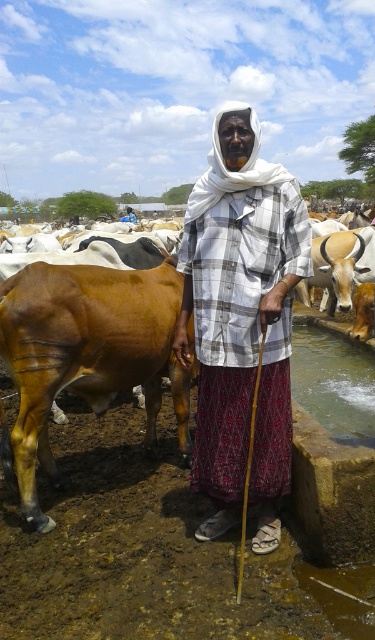
Question: Can you confirm if white checkered shirt at center is smaller than brown glossy bull at left?

Choices:
 (A) yes
 (B) no

Answer: (A)

Question: Which point is farther from the camera taking this photo?

Choices:
 (A) (268, 198)
 (B) (114, 285)

Answer: (B)

Question: Which point is farther to the camera?

Choices:
 (A) (265, 522)
 (B) (169, 365)

Answer: (B)

Question: Where is white checkered shirt at center located in relation to brown glossy bull at left in the image?

Choices:
 (A) right
 (B) left

Answer: (A)

Question: Considering the relative positions of white checkered shirt at center and brown glossy bull at left in the image provided, where is white checkered shirt at center located with respect to brown glossy bull at left?

Choices:
 (A) right
 (B) left

Answer: (A)

Question: Among these points, which one is farthest from the camera?

Choices:
 (A) (220, 458)
 (B) (180, 406)

Answer: (B)